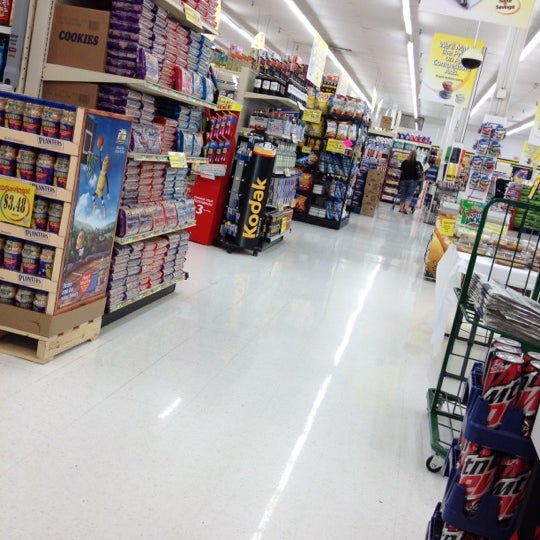
This screenshot has width=540, height=540. What are the coordinates of `empty space on floor` in the screenshot? It's located at (182, 441), (279, 332), (373, 248).